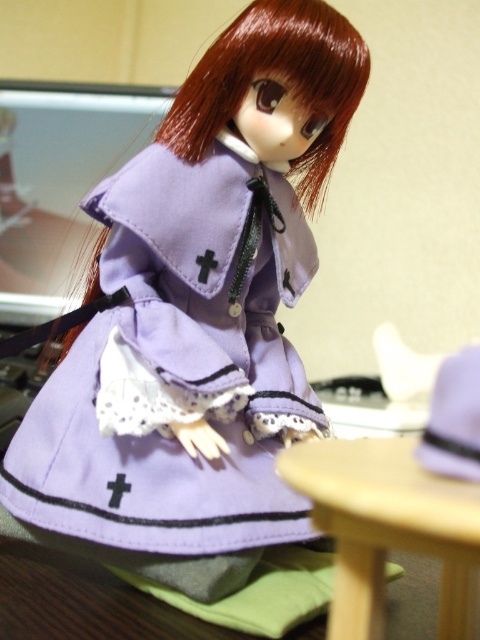
Does light wood table at lower right have a lesser height compared to purple fabric hat at right?

In fact, light wood table at lower right may be taller than purple fabric hat at right.

Can you confirm if light wood table at lower right is thinner than purple fabric hat at right?

No, light wood table at lower right is not thinner than purple fabric hat at right.

The width and height of the screenshot is (480, 640). I want to click on light wood table at lower right, so click(387, 528).

I want to click on light wood table at lower right, so click(387, 528).

Does shiny red hair at center come in front of purple fabric hat at right?

That is False.

Does point (272, 6) lie behind point (456, 369)?

That is True.

Find the location of `shiny red hair at center`. shiny red hair at center is located at coordinates (282, 74).

Can you confirm if lavender fabric dress at center is taller than purple fabric hat at right?

Correct, lavender fabric dress at center is much taller as purple fabric hat at right.

Is lavender fabric dress at center smaller than purple fabric hat at right?

Incorrect, lavender fabric dress at center is not smaller in size than purple fabric hat at right.

Image resolution: width=480 pixels, height=640 pixels. I want to click on lavender fabric dress at center, so click(196, 317).